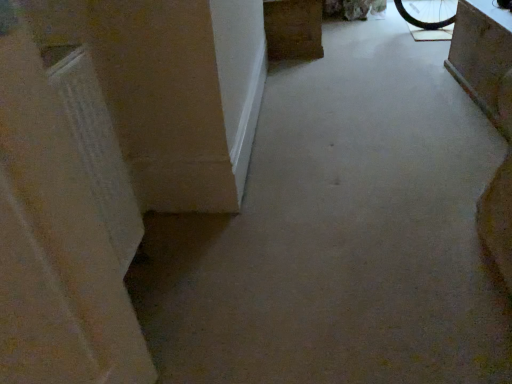
The height and width of the screenshot is (384, 512). What do you see at coordinates (293, 29) in the screenshot?
I see `brown wood cabinet at upper center, which is counted as the 2th furniture, starting from the bottom` at bounding box center [293, 29].

The image size is (512, 384). What are the coordinates of `brown wood cabinet at upper center, acting as the 1th furniture starting from the top` in the screenshot? It's located at (293, 29).

In order to face brown wood cabinet at upper center, acting as the second furniture starting from the right, should I rotate leftwards or rightwards?

To face it directly, rotate right by 4.521 degrees.

Find the location of `concrete block at upper right, the 1th furniture in the bottom-to-top sequence`. concrete block at upper right, the 1th furniture in the bottom-to-top sequence is located at coordinates (481, 54).

Describe the element at coordinates (481, 54) in the screenshot. I see `concrete block at upper right, which ranks as the first furniture in front-to-back order` at that location.

This screenshot has width=512, height=384. Identify the location of brown wood cabinet at upper center, the 1th furniture in the left-to-right sequence. click(x=293, y=29).

Considering the relative positions of brown wood cabinet at upper center, which is counted as the 2th furniture, starting from the bottom, and concrete block at upper right, which ranks as the first furniture in front-to-back order, in the image provided, is brown wood cabinet at upper center, which is counted as the 2th furniture, starting from the bottom, to the left of concrete block at upper right, which ranks as the first furniture in front-to-back order, from the viewer's perspective?

Yes, brown wood cabinet at upper center, which is counted as the 2th furniture, starting from the bottom, is to the left of concrete block at upper right, which ranks as the first furniture in front-to-back order.

Is brown wood cabinet at upper center, the 1th furniture in the left-to-right sequence, positioned before concrete block at upper right, acting as the 2th furniture starting from the left?

No, it is behind concrete block at upper right, acting as the 2th furniture starting from the left.

Does point (300, 17) lie in front of point (485, 113)?

No.

From the image's perspective, is brown wood cabinet at upper center, arranged as the first furniture when viewed from the back, under concrete block at upper right, the second furniture in the back-to-front sequence?

No.

From a real-world perspective, is brown wood cabinet at upper center, the 1th furniture in the left-to-right sequence, located higher than concrete block at upper right, the 1th furniture positioned from the right?

Actually, brown wood cabinet at upper center, the 1th furniture in the left-to-right sequence, is physically below concrete block at upper right, the 1th furniture positioned from the right, in the real world.

Can you confirm if brown wood cabinet at upper center, the 1th furniture in the left-to-right sequence, is wider than concrete block at upper right, which ranks as the first furniture in front-to-back order?

Correct, the width of brown wood cabinet at upper center, the 1th furniture in the left-to-right sequence, exceeds that of concrete block at upper right, which ranks as the first furniture in front-to-back order.

Which of these two, brown wood cabinet at upper center, acting as the 1th furniture starting from the top, or concrete block at upper right, acting as the 2th furniture starting from the left, stands taller?

concrete block at upper right, acting as the 2th furniture starting from the left, is taller.

Considering the sizes of objects brown wood cabinet at upper center, acting as the second furniture starting from the right, and concrete block at upper right, the second furniture in the back-to-front sequence, in the image provided, who is smaller, brown wood cabinet at upper center, acting as the second furniture starting from the right, or concrete block at upper right, the second furniture in the back-to-front sequence,?

With smaller size is concrete block at upper right, the second furniture in the back-to-front sequence.

Would you say brown wood cabinet at upper center, acting as the second furniture starting from the right, is outside concrete block at upper right, the 1th furniture in the bottom-to-top sequence?

Absolutely, brown wood cabinet at upper center, acting as the second furniture starting from the right, is external to concrete block at upper right, the 1th furniture in the bottom-to-top sequence.

Is brown wood cabinet at upper center, acting as the second furniture starting from the right, oriented away from concrete block at upper right, the 1th furniture in the bottom-to-top sequence?

No, concrete block at upper right, the 1th furniture in the bottom-to-top sequence, is not at the back of brown wood cabinet at upper center, acting as the second furniture starting from the right.

Measure the distance between brown wood cabinet at upper center, which is the second furniture in front-to-back order, and concrete block at upper right, the 2th furniture in the top-to-bottom sequence.

brown wood cabinet at upper center, which is the second furniture in front-to-back order, and concrete block at upper right, the 2th furniture in the top-to-bottom sequence, are 1.07 meters apart from each other.

Locate an element on the screen. furniture in front of the brown wood cabinet at upper center, the 1th furniture in the left-to-right sequence is located at coordinates (481, 54).

Between concrete block at upper right, the 2th furniture in the top-to-bottom sequence, and brown wood cabinet at upper center, which is the second furniture in front-to-back order, which one appears on the right side from the viewer's perspective?

Positioned to the right is concrete block at upper right, the 2th furniture in the top-to-bottom sequence.

Based on the photo, is the position of concrete block at upper right, the 1th furniture positioned from the right, more distant than that of brown wood cabinet at upper center, arranged as the first furniture when viewed from the back?

No, concrete block at upper right, the 1th furniture positioned from the right, is closer to the camera.

Is point (480, 82) positioned after point (305, 23)?

No.

From the image's perspective, is concrete block at upper right, the second furniture in the back-to-front sequence, located above brown wood cabinet at upper center, the 1th furniture in the left-to-right sequence?

No, from the image's perspective, concrete block at upper right, the second furniture in the back-to-front sequence, is not over brown wood cabinet at upper center, the 1th furniture in the left-to-right sequence.

From a real-world perspective, which is physically below, concrete block at upper right, which ranks as the first furniture in front-to-back order, or brown wood cabinet at upper center, arranged as the first furniture when viewed from the back?

From a 3D spatial view, brown wood cabinet at upper center, arranged as the first furniture when viewed from the back, is below.

Which of these two, concrete block at upper right, the 2th furniture in the top-to-bottom sequence, or brown wood cabinet at upper center, which is counted as the 2th furniture, starting from the bottom, is thinner?

With smaller width is concrete block at upper right, the 2th furniture in the top-to-bottom sequence.

Can you confirm if concrete block at upper right, which ranks as the first furniture in front-to-back order, is taller than brown wood cabinet at upper center, which is counted as the 2th furniture, starting from the bottom?

Indeed, concrete block at upper right, which ranks as the first furniture in front-to-back order, has a greater height compared to brown wood cabinet at upper center, which is counted as the 2th furniture, starting from the bottom.

Between concrete block at upper right, the 1th furniture in the bottom-to-top sequence, and brown wood cabinet at upper center, acting as the 1th furniture starting from the top, which one has smaller size?

Smaller between the two is concrete block at upper right, the 1th furniture in the bottom-to-top sequence.

Is concrete block at upper right, acting as the 2th furniture starting from the left, not within brown wood cabinet at upper center, acting as the 1th furniture starting from the top?

Indeed, concrete block at upper right, acting as the 2th furniture starting from the left, is completely outside brown wood cabinet at upper center, acting as the 1th furniture starting from the top.

Is concrete block at upper right, which ranks as the first furniture in front-to-back order, in contact with brown wood cabinet at upper center, the 1th furniture in the left-to-right sequence?

→ concrete block at upper right, which ranks as the first furniture in front-to-back order, and brown wood cabinet at upper center, the 1th furniture in the left-to-right sequence, are not in contact.

Is concrete block at upper right, the 1th furniture positioned from the right, facing towards brown wood cabinet at upper center, acting as the second furniture starting from the right?

No.

How much distance is there between concrete block at upper right, the 2th furniture in the top-to-bottom sequence, and brown wood cabinet at upper center, the 1th furniture in the left-to-right sequence?

concrete block at upper right, the 2th furniture in the top-to-bottom sequence, is 1.07 meters away from brown wood cabinet at upper center, the 1th furniture in the left-to-right sequence.

Locate an element on the screen. furniture lying above the concrete block at upper right, the 2th furniture in the top-to-bottom sequence (from the image's perspective) is located at coordinates (293, 29).

Image resolution: width=512 pixels, height=384 pixels. What are the coordinates of `furniture in front of the brown wood cabinet at upper center, the 1th furniture in the left-to-right sequence` in the screenshot? It's located at (481, 54).

In order to click on furniture that appears above the brown wood cabinet at upper center, arranged as the first furniture when viewed from the back (from a real-world perspective) in this screenshot , I will do `click(481, 54)`.